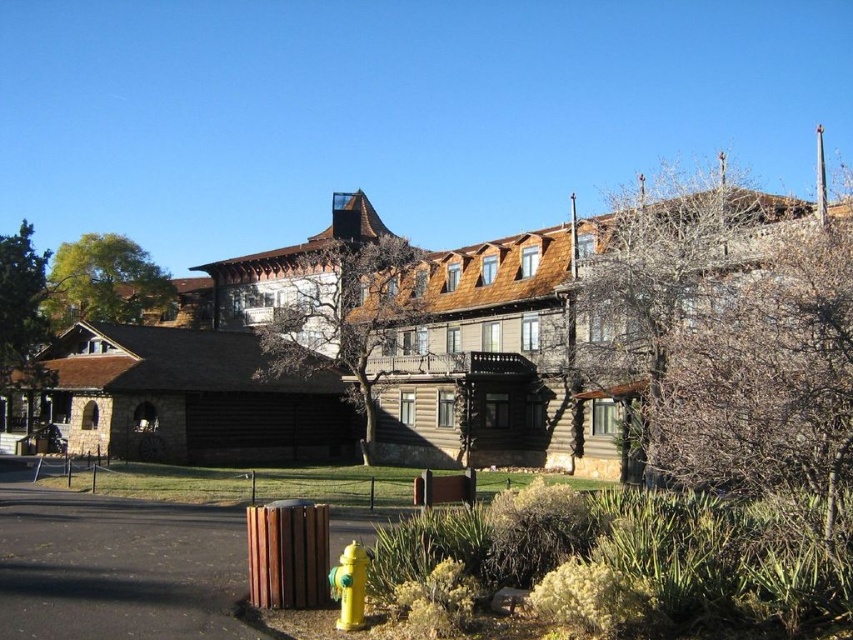
Is brown wooden tree at upper center positioned behind green leafy tree at upper left?

No, brown wooden tree at upper center is closer to the viewer.

How far apart are brown wooden tree at upper center and green leafy tree at upper left?

brown wooden tree at upper center is 112.70 feet from green leafy tree at upper left.

You are a GUI agent. You are given a task and a screenshot of the screen. Output one action in this format:
    pyautogui.click(x=<x>, y=<y>)
    Task: Click on the brown wooden tree at upper center
    Image resolution: width=853 pixels, height=640 pixels.
    Given the screenshot: What is the action you would take?
    pyautogui.click(x=345, y=316)

Identify the location of brown wooden tree at upper center. The image size is (853, 640). (345, 316).

Is point (836, 531) closer to viewer compared to point (360, 582)?

Yes, it is in front of point (360, 582).

Who is higher up, brown textured tree at upper right or yellow matte fire hydrant at lower center?

brown textured tree at upper right

Find the location of `brown textured tree at upper right`. brown textured tree at upper right is located at coordinates (732, 348).

The height and width of the screenshot is (640, 853). What are the coordinates of `brown textured tree at upper right` in the screenshot? It's located at (732, 348).

This screenshot has width=853, height=640. Find the location of `brown textured tree at upper right`. brown textured tree at upper right is located at coordinates (732, 348).

Image resolution: width=853 pixels, height=640 pixels. I want to click on brown textured tree at upper right, so click(x=732, y=348).